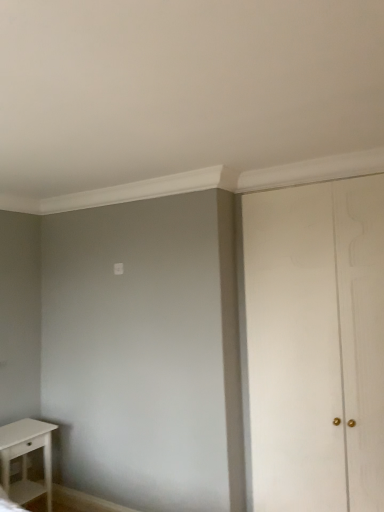
Question: Does white matte table at lower left have a greater width compared to white wood door at right?

Choices:
 (A) yes
 (B) no

Answer: (A)

Question: Considering the relative sizes of white matte table at lower left and white wood door at right in the image provided, is white matte table at lower left bigger than white wood door at right?

Choices:
 (A) yes
 (B) no

Answer: (B)

Question: Is white matte table at lower left taller than white wood door at right?

Choices:
 (A) no
 (B) yes

Answer: (A)

Question: From a real-world perspective, does white matte table at lower left sit lower than white wood door at right?

Choices:
 (A) yes
 (B) no

Answer: (A)

Question: Can white wood door at right be found inside white matte table at lower left?

Choices:
 (A) yes
 (B) no

Answer: (B)

Question: From a real-world perspective, is white matte table at lower left on top of white wood door at right?

Choices:
 (A) yes
 (B) no

Answer: (B)

Question: Is white matte table at lower left completely or partially inside white wood door at right?

Choices:
 (A) yes
 (B) no

Answer: (B)

Question: Is white wood door at right wider than white matte table at lower left?

Choices:
 (A) yes
 (B) no

Answer: (B)

Question: Is white wood door at right looking in the opposite direction of white matte table at lower left?

Choices:
 (A) yes
 (B) no

Answer: (B)

Question: From the image's perspective, is white wood door at right under white matte table at lower left?

Choices:
 (A) yes
 (B) no

Answer: (B)

Question: Is white wood door at right aimed at white matte table at lower left?

Choices:
 (A) yes
 (B) no

Answer: (B)

Question: Is white wood door at right shorter than white matte table at lower left?

Choices:
 (A) no
 (B) yes

Answer: (A)

Question: Is white matte table at lower left in front of or behind white wood door at right in the image?

Choices:
 (A) behind
 (B) front

Answer: (A)